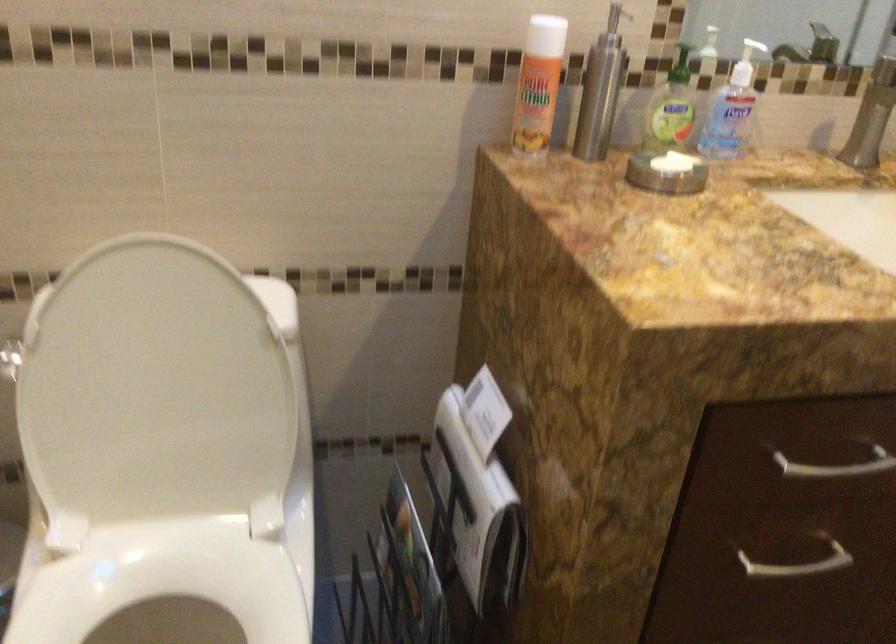
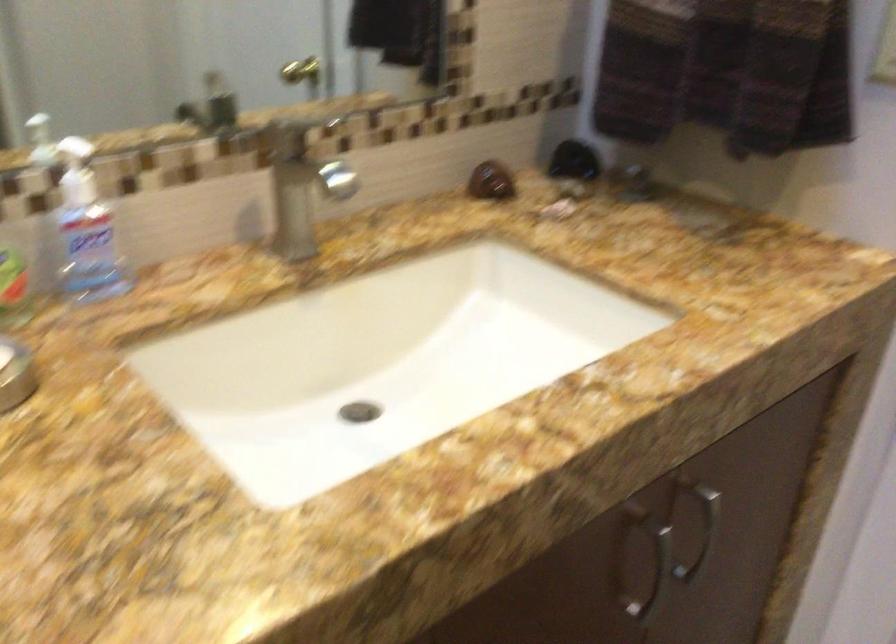
Question: The images are taken continuously from a first-person perspective. In which direction is your viewpoint rotating?

Choices:
 (A) Left
 (B) Right
 (C) Up
 (D) Down

Answer: (B)